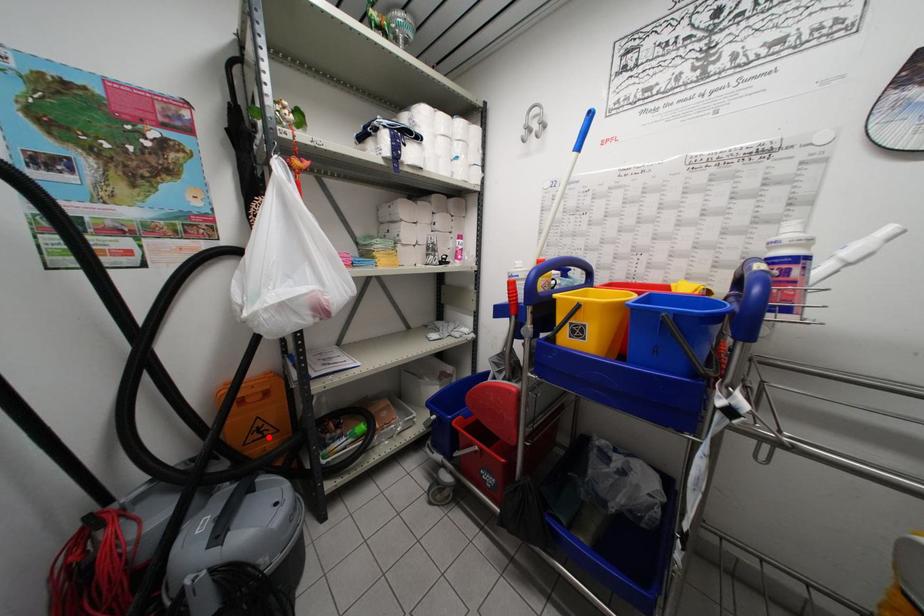
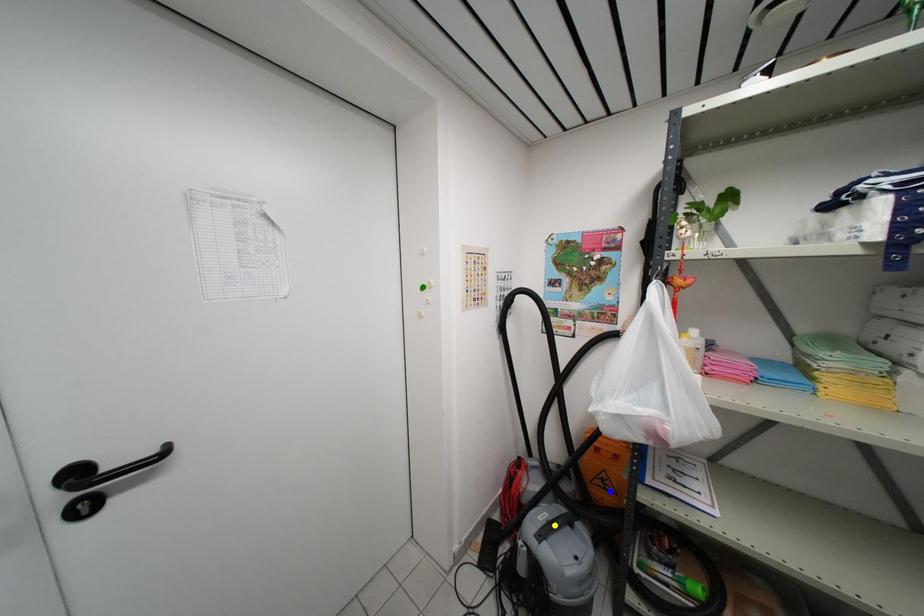
Question: I am providing you with two images of the same scene from different viewpoints. A red point is marked on the first image. You are given multiple points on the second image. Which mark in image 2 goes with the point in image 1?

Choices:
 (A) blue point
 (B) green point
 (C) yellow point

Answer: (A)